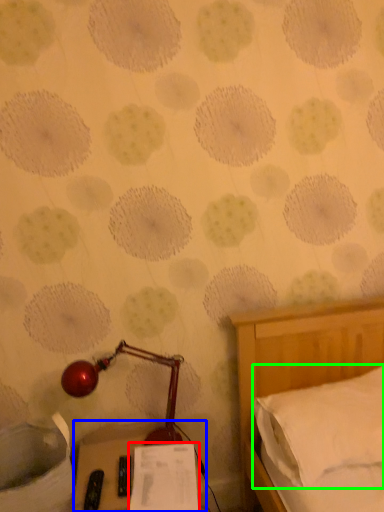
Question: Based on their relative distances, which object is nearer to paper (highlighted by a red box)? Choose from furniture (highlighted by a blue box) and pillow (highlighted by a green box).

Choices:
 (A) furniture
 (B) pillow

Answer: (A)